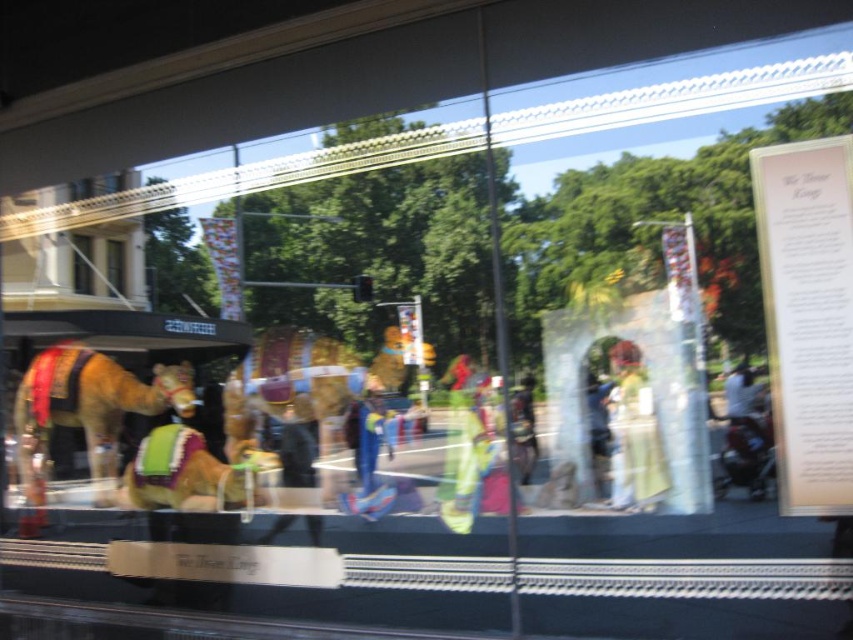
Question: Among these points, which one is nearest to the camera?

Choices:
 (A) (113, 284)
 (B) (36, 497)
 (C) (595, 484)
 (D) (779, 253)

Answer: (D)

Question: Estimate the real-world distances between objects in this image. Which object is farther from the green velvet camel at center?

Choices:
 (A) transparent glass window at center
 (B) white paper at upper right
 (C) matte brown camel at center

Answer: (B)

Question: Can you confirm if matte brown camel at center is positioned to the left of green velvet camel at center?

Choices:
 (A) no
 (B) yes

Answer: (A)

Question: Is white paper at upper right further to camera compared to blue denim jeans at center?

Choices:
 (A) no
 (B) yes

Answer: (A)

Question: Is matte brown camel at left above transparent glass window at center?

Choices:
 (A) no
 (B) yes

Answer: (B)

Question: Which object is the farthest from the white paper at upper right?

Choices:
 (A) blue denim jeans at center
 (B) matte brown camel at center

Answer: (B)